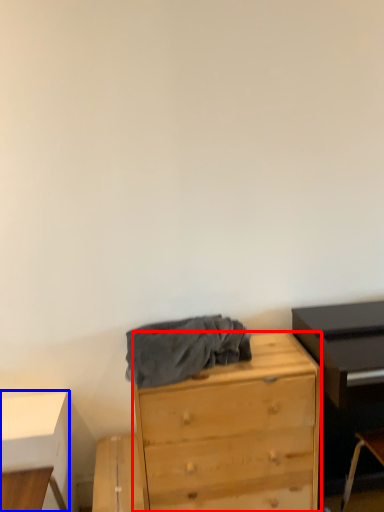
Question: Which object is closer to the camera taking this photo, chest of drawers (highlighted by a red box) or table (highlighted by a blue box)?

Choices:
 (A) chest of drawers
 (B) table

Answer: (A)